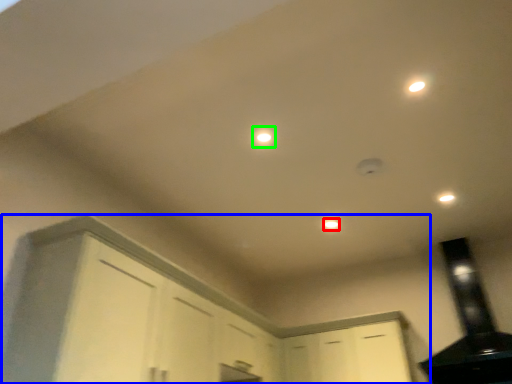
Question: Based on their relative distances, which object is farther from dot (highlighted by a red box)? Choose from cabinetry (highlighted by a blue box) and light (highlighted by a green box).

Choices:
 (A) cabinetry
 (B) light

Answer: (A)